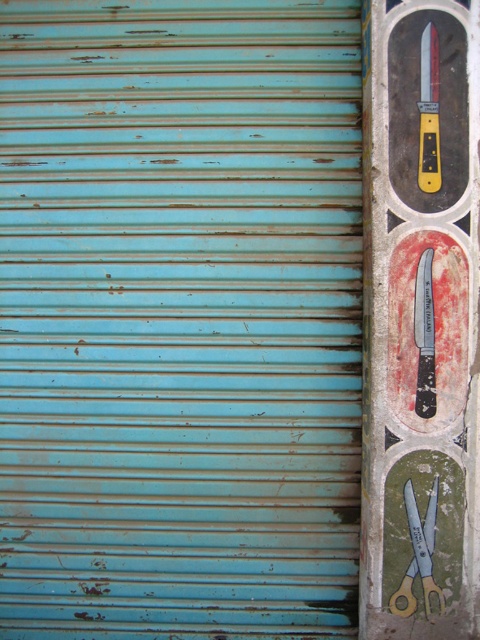
Which is in front, point (405, 413) or point (409, 504)?

Positioned in front is point (405, 413).

Is point (430, 166) behind point (428, 538)?

No, (430, 166) is in front of (428, 538).

Identify the location of painted wood knife at right. The image size is (480, 640). (420, 321).

Between painted wood knife at right and black textured knife at right, which one is positioned higher?

painted wood knife at right is above.

Between point (377, 115) and point (428, 342), which one is positioned behind?

Point (428, 342)

Find the location of `painted wood knife at right`. painted wood knife at right is located at coordinates (420, 321).

Between blue metallic scissors at right and black textured knife at right, which one is positioned lower?

blue metallic scissors at right is below.

Does point (433, 545) lie behind point (416, 285)?

Yes, point (433, 545) is farther from viewer.

Where is `blue metallic scissors at right`? Image resolution: width=480 pixels, height=640 pixels. blue metallic scissors at right is located at coordinates (419, 554).